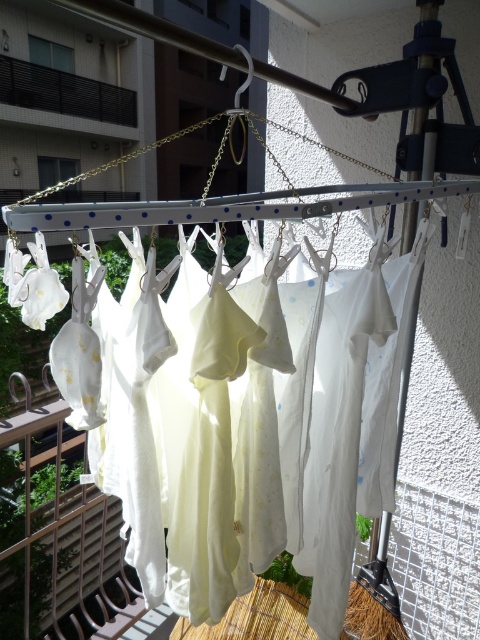
Which is in front, point (312, 529) or point (48, 88)?

Positioned in front is point (312, 529).

Which is more to the left, white cotton shirts at center or black metal railing at upper left?

Positioned to the left is black metal railing at upper left.

Is point (424, 244) in front of point (120, 88)?

That is True.

At what (x,y) coordinates should I click in order to perform the action: click on white cotton shirts at center. Please return your answer as a coordinate pair (x, y). This screenshot has height=640, width=480. Looking at the image, I should click on (343, 420).